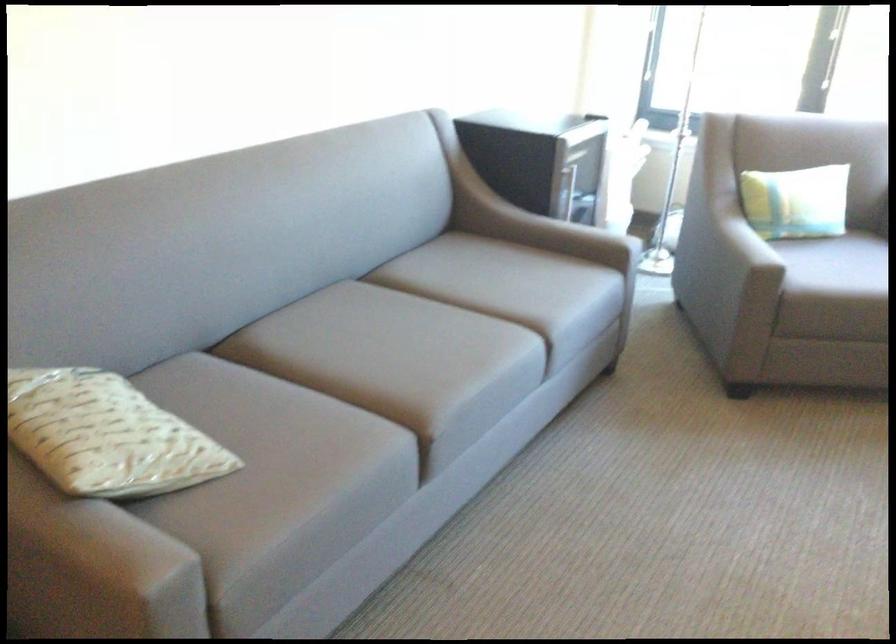
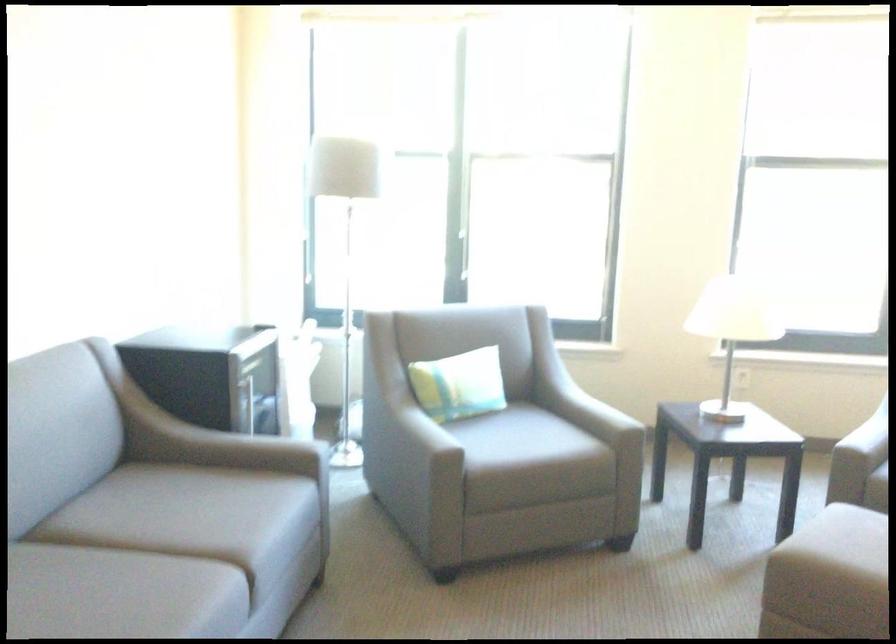
The point at (794, 204) is marked in the first image. Where is the corresponding point in the second image?

(459, 384)